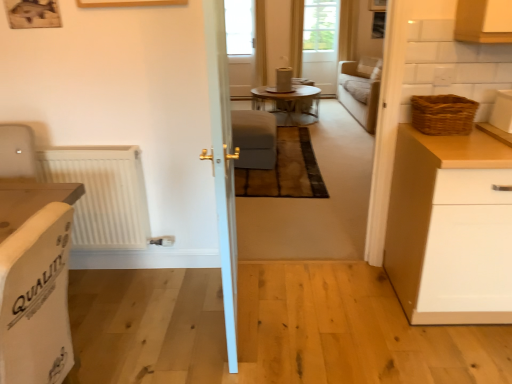
Locate an element on the screen. The width and height of the screenshot is (512, 384). vacant region below white ribbed radiator at left (from a real-world perspective) is located at coordinates (138, 266).